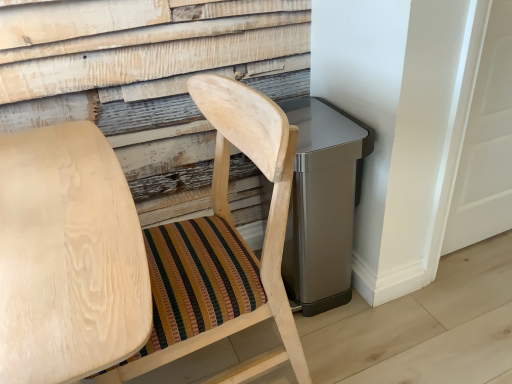
Question: Looking at their shapes, would you say natural wood chair at center, positioned as the 1th chair in right-to-left order, is wider or thinner than natural wood chair at center, which is the first chair from left to right?

Choices:
 (A) wide
 (B) thin

Answer: (B)

Question: From a real-world perspective, is natural wood chair at center, positioned as the 1th chair in right-to-left order, physically located above or below natural wood chair at center, which is the first chair from left to right?

Choices:
 (A) above
 (B) below

Answer: (A)

Question: Does point (256, 92) appear closer or farther from the camera than point (117, 253)?

Choices:
 (A) farther
 (B) closer

Answer: (A)

Question: From a real-world perspective, is natural wood chair at center, which is the first chair from left to right, physically located above or below natural wood chair at center, positioned as the 1th chair in right-to-left order?

Choices:
 (A) above
 (B) below

Answer: (B)

Question: In the image, is natural wood chair at center, which is the first chair from left to right, on the left side or the right side of natural wood chair at center, acting as the second chair starting from the left?

Choices:
 (A) right
 (B) left

Answer: (B)

Question: Based on their sizes in the image, would you say natural wood chair at center, which is the first chair from left to right, is bigger or smaller than natural wood chair at center, positioned as the 1th chair in right-to-left order?

Choices:
 (A) small
 (B) big

Answer: (B)

Question: Considering the positions of point (117, 296) and point (108, 288), is point (117, 296) closer or farther from the camera than point (108, 288)?

Choices:
 (A) closer
 (B) farther

Answer: (A)